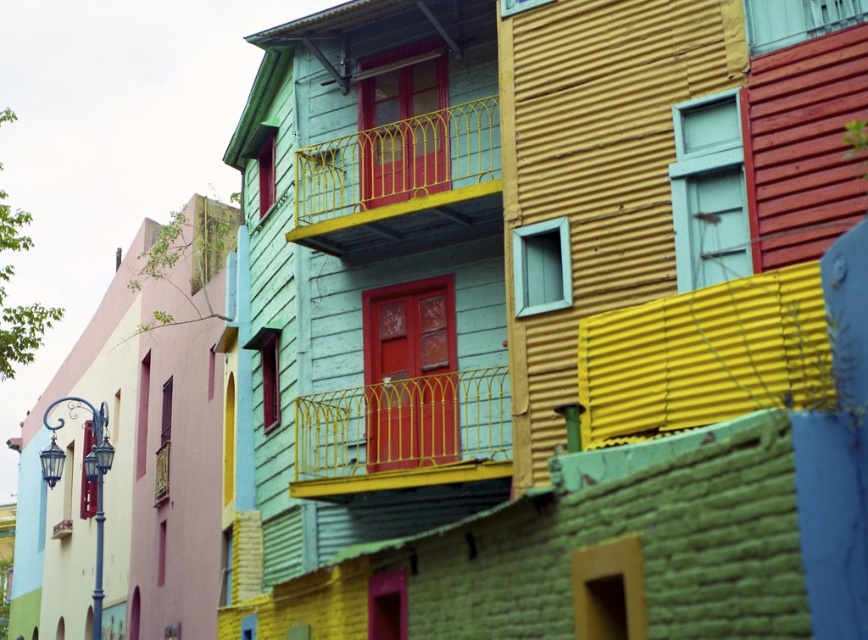
What is the color of the building material at the point marked by coordinates (704,356)?

The point marked by coordinates (704,356) is yellow corrugated metal.